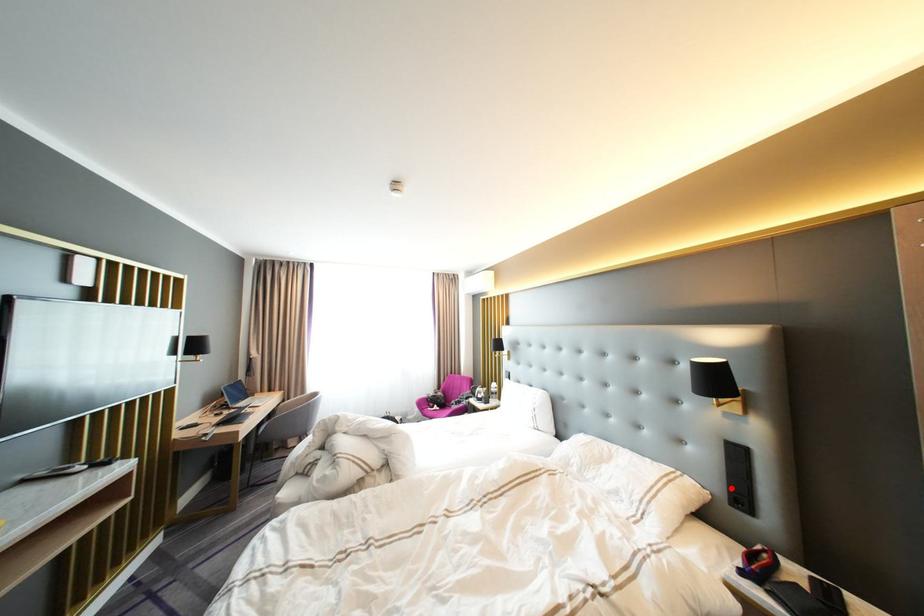
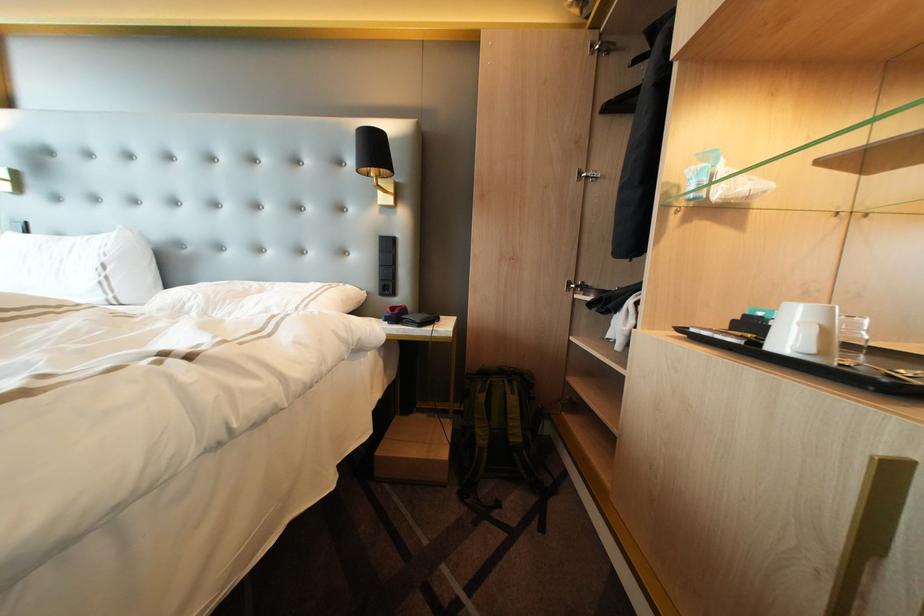
Find the pixel in the second image that matches the highlighted location in the first image.

(384, 284)